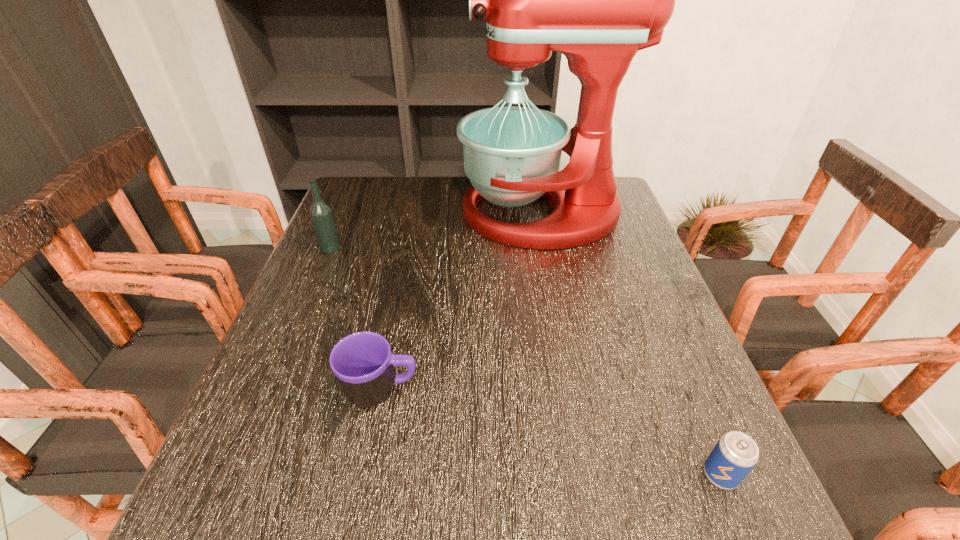
Find the location of a particular element. The width and height of the screenshot is (960, 540). free space between the vodka and the second shortest object is located at coordinates (356, 319).

This screenshot has width=960, height=540. Find the location of `vacant space that's between the vodka and the beer can`. vacant space that's between the vodka and the beer can is located at coordinates (525, 361).

Image resolution: width=960 pixels, height=540 pixels. I want to click on free point between the beer can and the mixer, so click(631, 344).

Where is `free space between the third tallest object and the third shortest object`? The image size is (960, 540). free space between the third tallest object and the third shortest object is located at coordinates (356, 319).

In order to click on free area in between the third object from right to left and the vodka in this screenshot , I will do `click(356, 319)`.

Where is `unoccupied position between the mixer and the third farthest object`? unoccupied position between the mixer and the third farthest object is located at coordinates (461, 302).

Choose which object is the nearest neighbor to the leftmost object. Please provide its 2D coordinates. Your answer should be formatted as a tuple, i.e. [(x, y)], where the tuple contains the x and y coordinates of a point satisfying the conditions above.

[(598, 0)]

Locate an element on the screen. Image resolution: width=960 pixels, height=540 pixels. object that stands as the closest to the beer can is located at coordinates (363, 363).

This screenshot has height=540, width=960. What are the coordinates of `vacant area in the image that satisfies the following two spatial constraints: 1. on the back side of the shortest object; 2. on the front-facing side of the mixer` in the screenshot? It's located at (612, 213).

This screenshot has height=540, width=960. I want to click on free space that satisfies the following two spatial constraints: 1. on the front-facing side of the tallest object; 2. on the front side of the leftmost object, so click(548, 248).